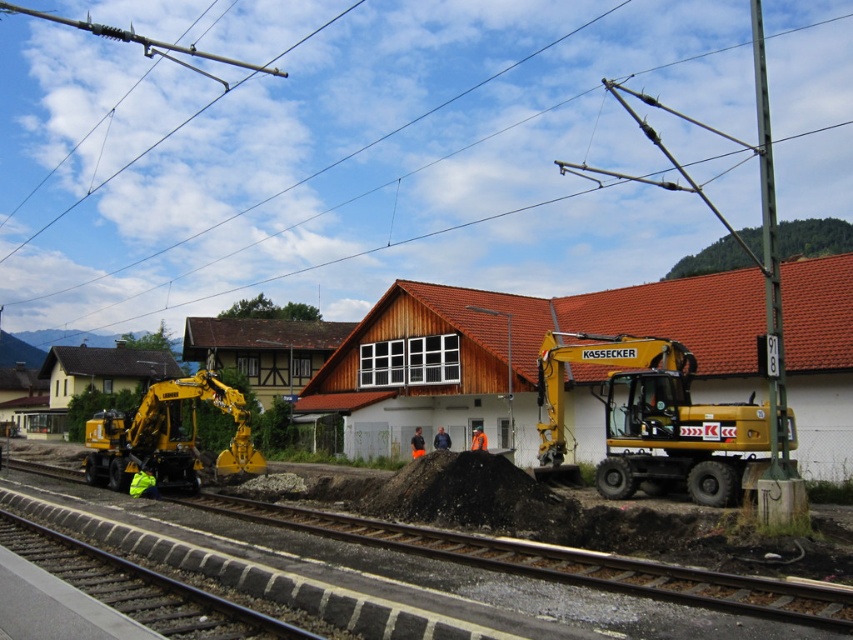
Question: Which object is the farthest from the yellow rubber excavator at lower left?

Choices:
 (A) smooth asphalt track at lower left
 (B) gray gravel train track at lower left
 (C) yellow metallic excavator at right

Answer: (C)

Question: Which point is farther from the camera taking this photo?

Choices:
 (A) (28, 534)
 (B) (225, 408)
 (C) (708, 404)
 (D) (297, 218)

Answer: (D)

Question: Does metallic wire at upper center have a greater width compared to smooth asphalt track at lower left?

Choices:
 (A) no
 (B) yes

Answer: (B)

Question: Which of the following is the farthest from the observer?

Choices:
 (A) (651, 45)
 (B) (136, 438)
 (C) (144, 621)

Answer: (A)

Question: Can you confirm if white wooden railway station at center is positioned above smooth asphalt track at lower left?

Choices:
 (A) no
 (B) yes

Answer: (B)

Question: Does white wooden railway station at center have a greater width compared to smooth asphalt track at lower left?

Choices:
 (A) yes
 (B) no

Answer: (B)